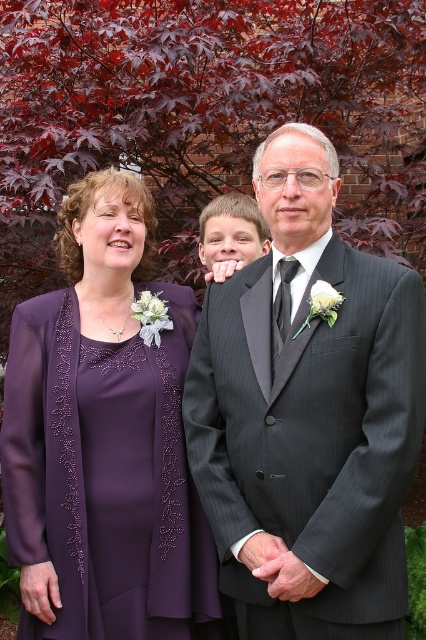
Based on the photo, which is more to the left, dark gray pinstripe suit at center or matte gray suit at center?

matte gray suit at center

Who is taller, dark gray pinstripe suit at center or matte gray suit at center?

Standing taller between the two is dark gray pinstripe suit at center.

Where is `dark gray pinstripe suit at center`? dark gray pinstripe suit at center is located at coordinates (307, 413).

Who is shorter, dark gray pinstripe suit at center or purple satin dress at left?

purple satin dress at left

Can you confirm if dark gray pinstripe suit at center is smaller than purple satin dress at left?

Actually, dark gray pinstripe suit at center might be larger than purple satin dress at left.

Find the location of `dark gray pinstripe suit at center`. dark gray pinstripe suit at center is located at coordinates (307, 413).

Between purple satin dress at left and matte gray suit at center, which one is positioned higher?

matte gray suit at center is above.

What do you see at coordinates (104, 474) in the screenshot? I see `purple satin dress at left` at bounding box center [104, 474].

You are a GUI agent. You are given a task and a screenshot of the screen. Output one action in this format:
    pyautogui.click(x=<x>, y=<y>)
    Task: Click on the purple satin dress at left
    The height and width of the screenshot is (640, 426).
    Given the screenshot: What is the action you would take?
    pyautogui.click(x=104, y=474)